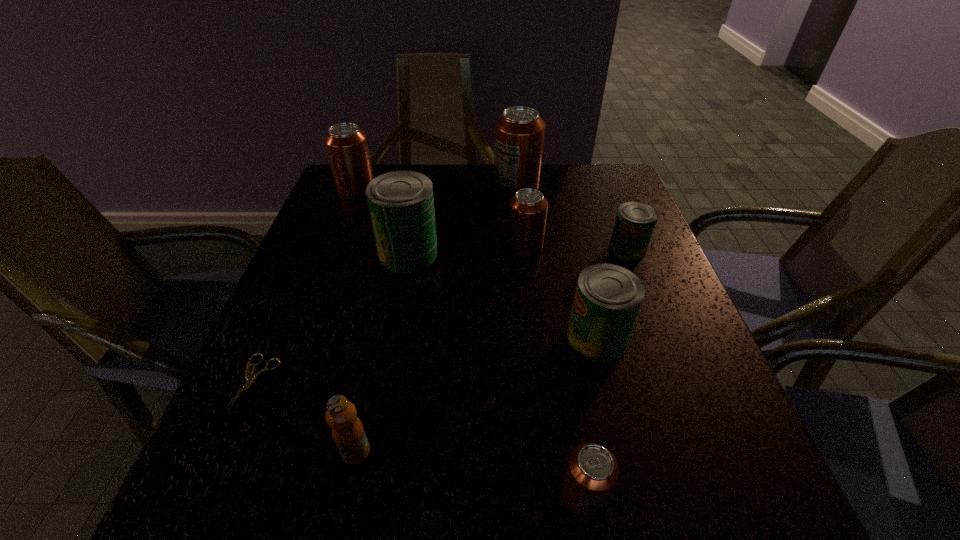
What are the coordinates of `free location located on the front of the nearest green can` in the screenshot? It's located at (626, 458).

The width and height of the screenshot is (960, 540). I want to click on vacant point located 0.080m on the front label of the eighth farthest object, so click(x=341, y=522).

I want to click on free location located on the left of the smallest green can, so click(489, 249).

Find the location of a particular element. free space located on the back of the smallest orange can is located at coordinates (573, 436).

At what (x,y) coordinates should I click in order to perform the action: click on vacant space situated on the back of the shortest object. Please return your answer as a coordinate pair (x, y). This screenshot has height=540, width=960. Looking at the image, I should click on (314, 249).

This screenshot has height=540, width=960. In order to click on orange juice present at the near edge in this screenshot , I will do `click(348, 433)`.

Find the location of `can at the near edge`. can at the near edge is located at coordinates (592, 472).

The image size is (960, 540). Find the location of `can located in the left edge section of the desktop`. can located in the left edge section of the desktop is located at coordinates (346, 144).

Find the location of a particular element. The width and height of the screenshot is (960, 540). shears that is at the left edge is located at coordinates (251, 379).

Locate an element on the screen. The width and height of the screenshot is (960, 540). object that is at the far left corner is located at coordinates (346, 144).